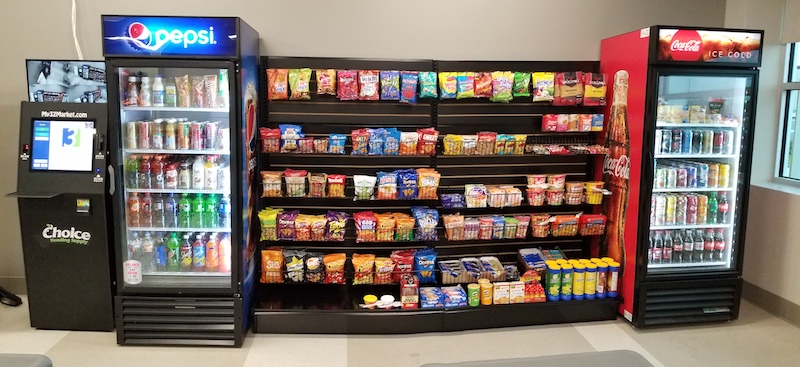
Identify the location of power cord. (74, 34).